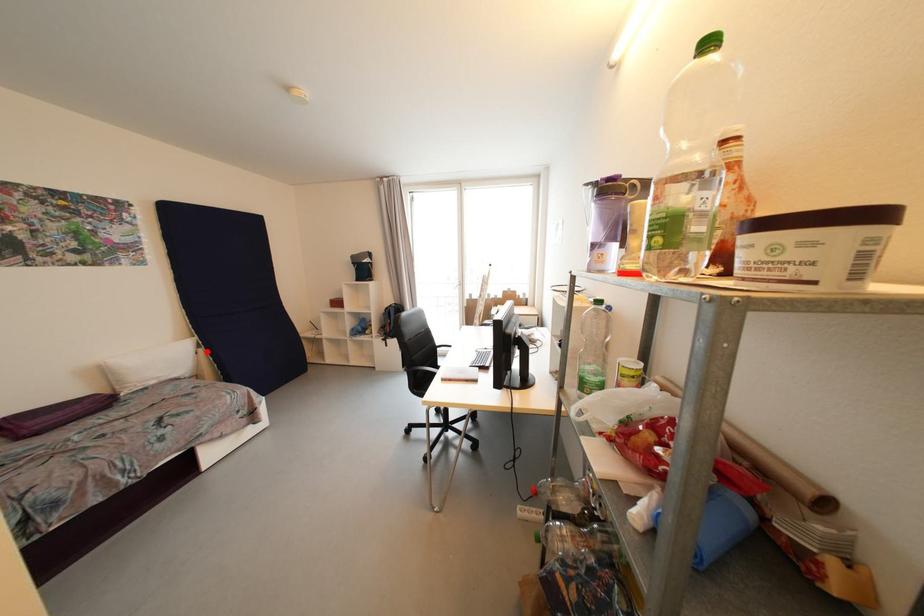
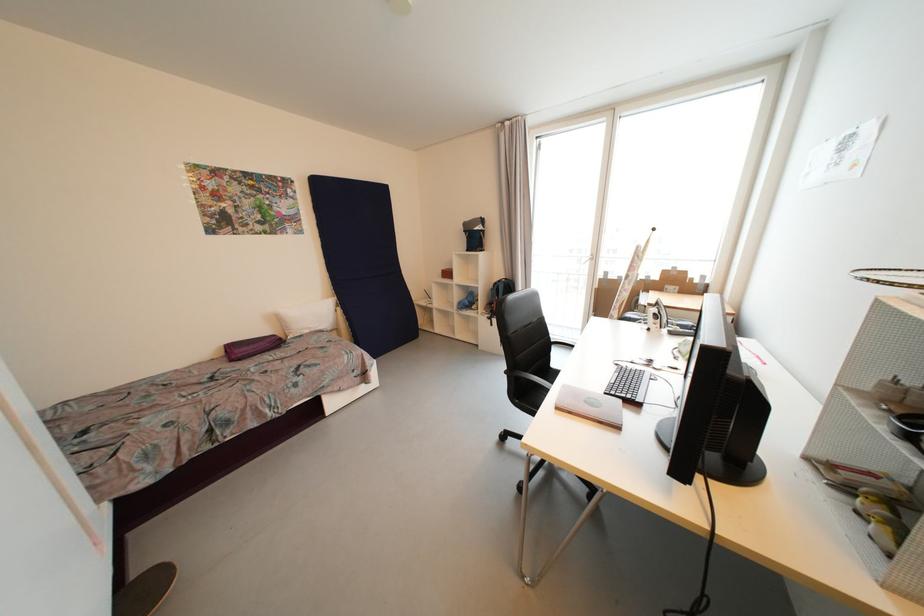
Where in the second image is the point corresponding to the highlighted location from the first image?

(344, 310)